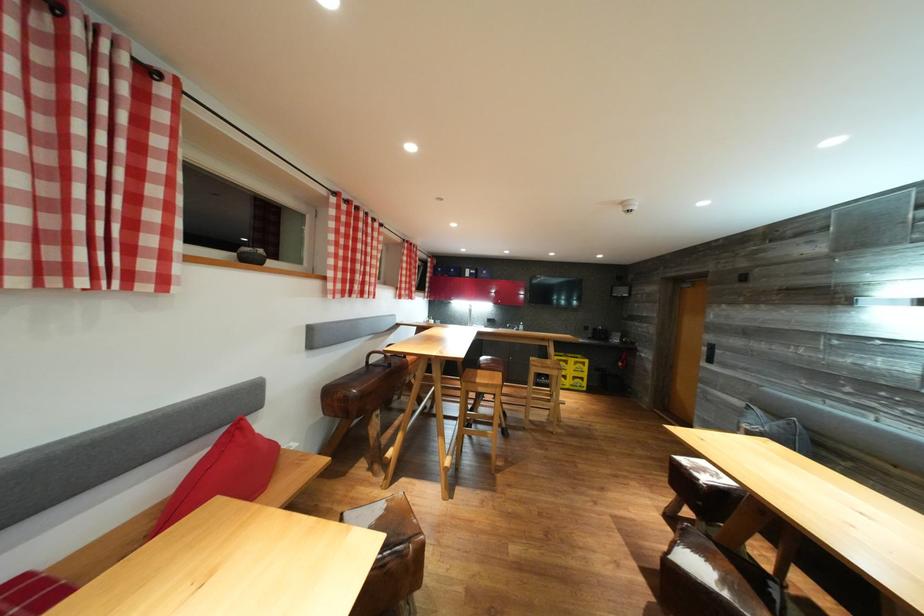
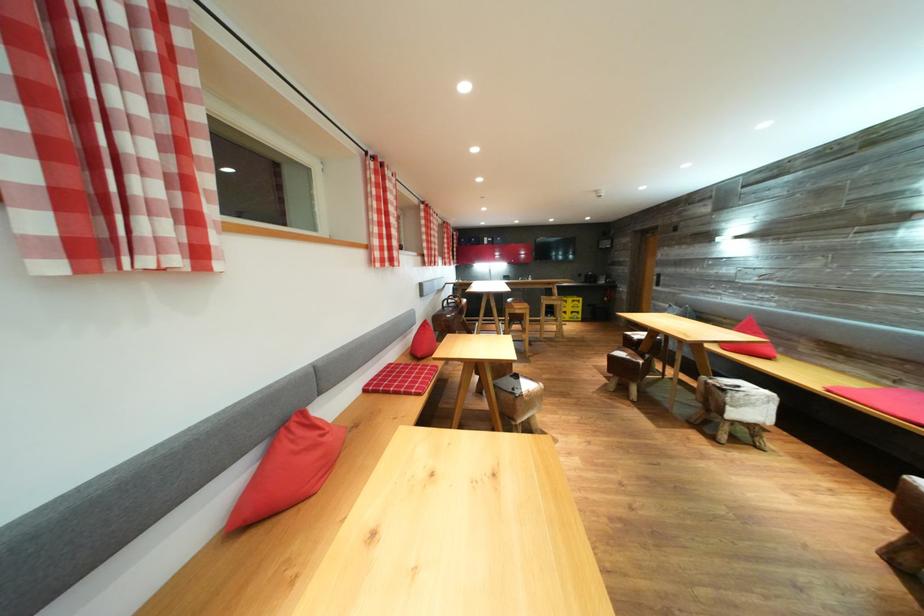
Question: I am providing you with two images of the same scene from different viewpoints. Please identify which objects are invisible in image2.

Choices:
 (A) bench sitting surface
 (B) red pillow
 (C) plaid seat cushion
 (D) none of these

Answer: (D)